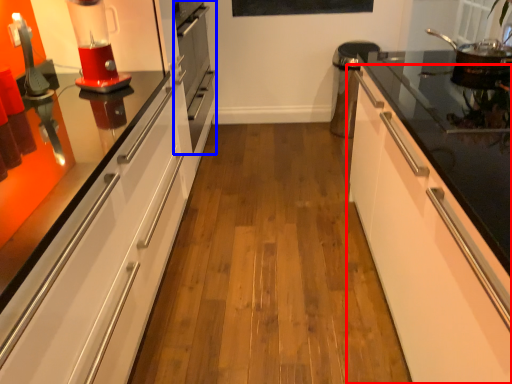
Question: Which object appears closest to the camera in this image, cabinetry (highlighted by a red box) or oven (highlighted by a blue box)?

Choices:
 (A) cabinetry
 (B) oven

Answer: (A)